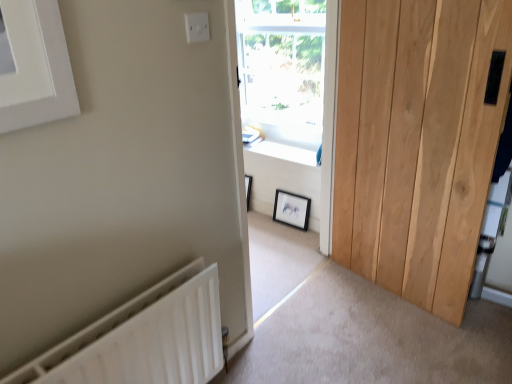
Identify the location of free space in front of natural wood door at right. (402, 342).